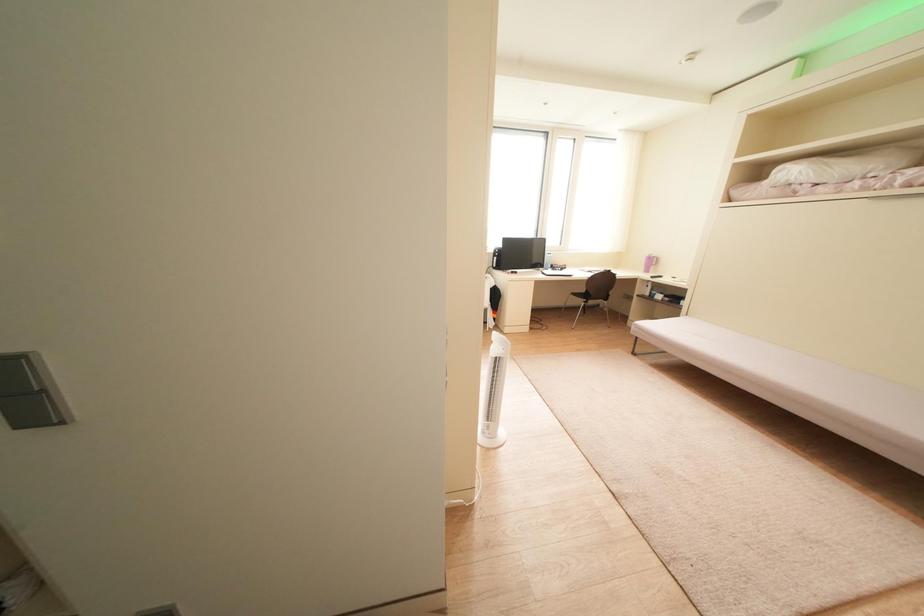
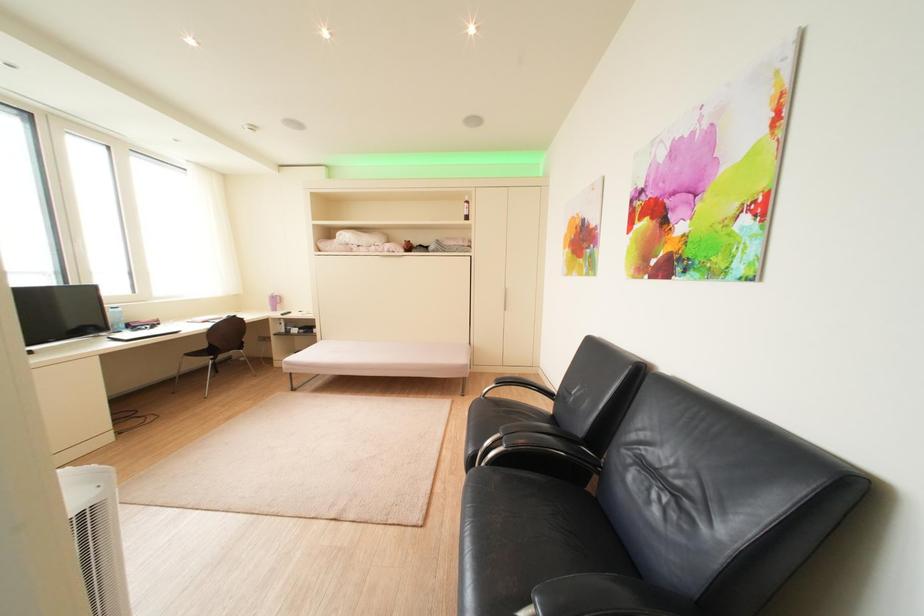
Question: The first image is from the beginning of the video and the second image is from the end. How did the camera likely rotate when shooting the video?

Choices:
 (A) Left
 (B) Right
 (C) Up
 (D) Down

Answer: (B)